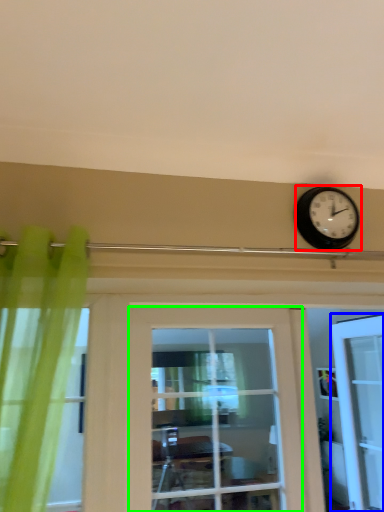
Question: Which object is the farthest from wall clock (highlighted by a red box)? Choose among these: door (highlighted by a blue box) or door (highlighted by a green box).

Choices:
 (A) door
 (B) door

Answer: (A)